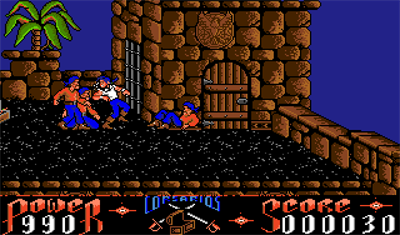
This screenshot has height=235, width=400. I want to click on door, so click(228, 93).